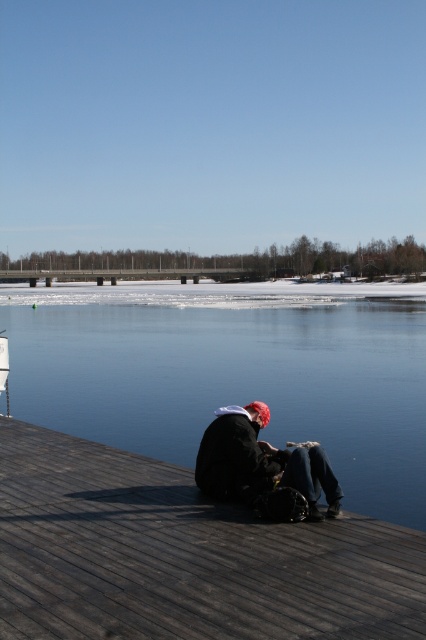
You are standing at the point marked as point (183, 556) on the image. What object are you currently standing on?

You are standing on the dark wood dock at lower center.

You are standing on the dock and want to walk towards the transparent ice at lower center. However, you need to step over the matte black jacket at center. Can you safely step over it without falling into the water?

The transparent ice at lower center is much taller than the matte black jacket at center. Since the ice is elevated higher, stepping over the jacket should be manageable as the height difference is significant, allowing safe passage.